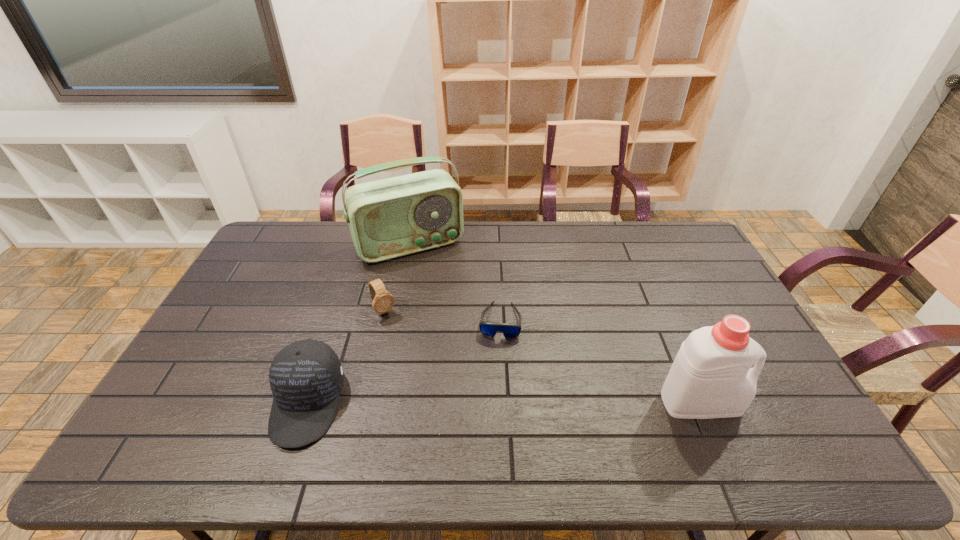
Locate an element on the screen. free point between the radio receiver and the fourth tallest object is located at coordinates (396, 278).

Image resolution: width=960 pixels, height=540 pixels. I want to click on vacant area that lies between the sunglasses and the baseball cap, so click(403, 362).

Identify the location of free spot between the third tallest object and the rightmost object. The height and width of the screenshot is (540, 960). (504, 403).

You are a GUI agent. You are given a task and a screenshot of the screen. Output one action in this format:
    pyautogui.click(x=<x>, y=<y>)
    Task: Click on the vacant space that is in between the radio receiver and the second shortest object
    The height and width of the screenshot is (540, 960).
    Given the screenshot: What is the action you would take?
    point(396,278)

This screenshot has height=540, width=960. I want to click on free spot between the rightmost object and the third tallest object, so click(x=504, y=403).

Identify which object is the third closest to the rightmost object. Please provide its 2D coordinates. Your answer should be formatted as a tuple, i.e. [(x, y)], where the tuple contains the x and y coordinates of a point satisfying the conditions above.

[(382, 301)]

Where is `the third closest object to the third tallest object`? The image size is (960, 540). the third closest object to the third tallest object is located at coordinates (388, 218).

Identify the location of free space in the image that satisfies the following two spatial constraints: 1. on the back side of the radio receiver; 2. on the left side of the fourth tallest object. (399, 245).

Image resolution: width=960 pixels, height=540 pixels. In order to click on vacant area that satisfies the following two spatial constraints: 1. on the front side of the detergent; 2. on the handle side of the sunglasses in this screenshot , I will do click(x=503, y=402).